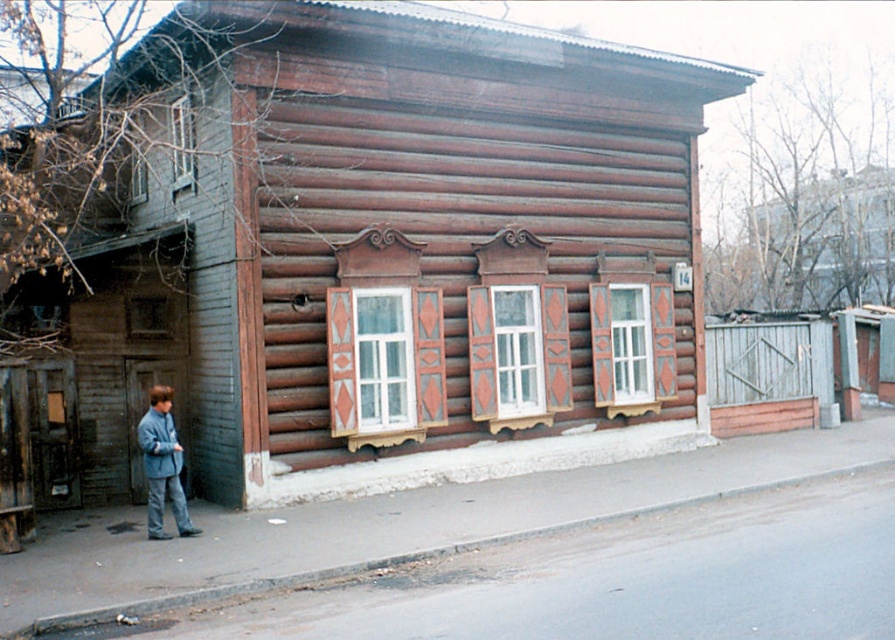
What is the spatial relationship between the gray concrete curb at lower center and the light blue fabric jacket at lower left in the scene?

The gray concrete curb at lower center is closer to the viewer than the light blue fabric jacket at lower left.

You are standing in front of the rustic wooden house. There is a small rectangular sign located at point (x=378, y=252). What is the object located at that point?

The point (x=378, y=252) marks the brown wooden hut at center.